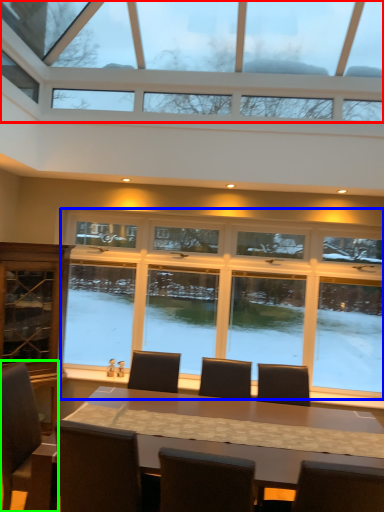
Question: Which object is the closest to the window (highlighted by a red box)? Choose among these: window (highlighted by a blue box) or chair (highlighted by a green box).

Choices:
 (A) window
 (B) chair

Answer: (A)